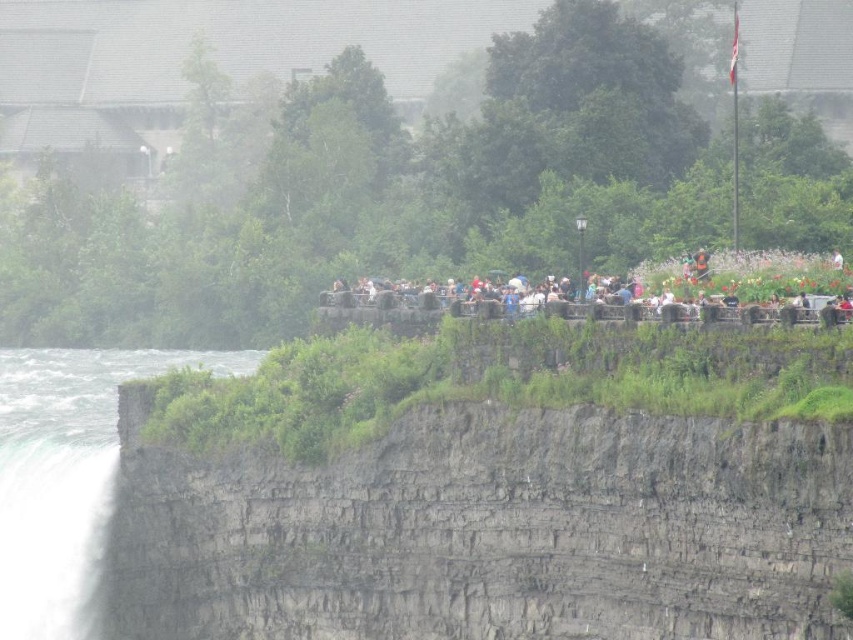
Does white frothy water at lower left have a smaller size compared to white misty waterfall at lower left?

No.

Is white frothy water at lower left to the right of white misty waterfall at lower left from the viewer's perspective?

No, white frothy water at lower left is not to the right of white misty waterfall at lower left.

Is point (102, 520) behind point (78, 499)?

No, (102, 520) is closer to viewer.

Where is `white frothy water at lower left`? This screenshot has width=853, height=640. white frothy water at lower left is located at coordinates (67, 477).

Between white frothy water at lower left and matte black people at center, which one is positioned lower?

white frothy water at lower left is below.

Is white frothy water at lower left closer to the viewer compared to matte black people at center?

No, white frothy water at lower left is behind matte black people at center.

Between point (6, 465) and point (785, 308), which one is positioned behind?

The point (6, 465) is behind.

The height and width of the screenshot is (640, 853). In order to click on white frothy water at lower left in this screenshot , I will do `click(67, 477)`.

Is point (61, 588) positioned before point (347, 292)?

Yes, it is.

Is white misty waterfall at lower left further to camera compared to matte black people at center?

That is True.

Locate an element on the screen. white misty waterfall at lower left is located at coordinates (53, 532).